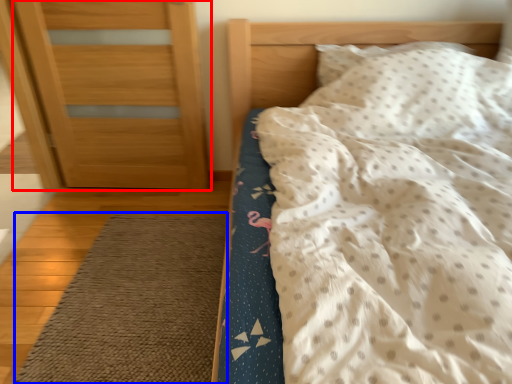
Question: Among these objects, which one is nearest to the camera, door (highlighted by a red box) or doormat (highlighted by a blue box)?

Choices:
 (A) door
 (B) doormat

Answer: (B)